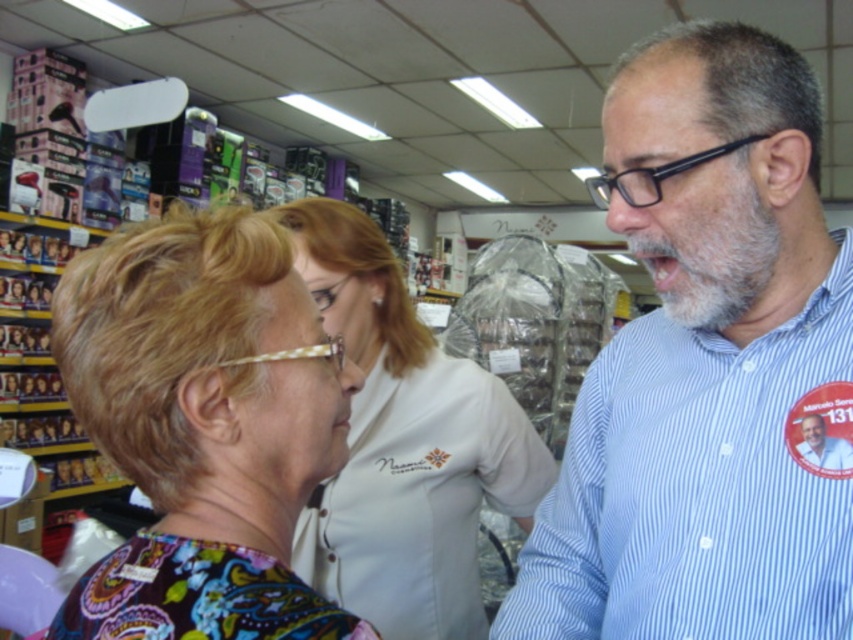
Can you confirm if multicolored fabric blouse at center is wider than white fabric shirt at center?

Incorrect, multicolored fabric blouse at center's width does not surpass white fabric shirt at center's.

Is multicolored fabric blouse at center positioned at the back of white fabric shirt at center?

No, it is in front of white fabric shirt at center.

The height and width of the screenshot is (640, 853). I want to click on multicolored fabric blouse at center, so click(202, 426).

Based on the photo, who is lower down, white fabric shirt at center or blue striped shirt at center?

Positioned lower is white fabric shirt at center.

Is white fabric shirt at center taller than blue striped shirt at center?

Correct, white fabric shirt at center is much taller as blue striped shirt at center.

Is point (329, 204) closer to camera compared to point (805, 451)?

No, it is behind (805, 451).

Find the location of a particular element. The height and width of the screenshot is (640, 853). white fabric shirt at center is located at coordinates (404, 445).

Is blue striped shirt at right above blue striped shirt at center?

Yes, blue striped shirt at right is above blue striped shirt at center.

Can you confirm if blue striped shirt at right is bigger than blue striped shirt at center?

Correct, blue striped shirt at right is larger in size than blue striped shirt at center.

This screenshot has width=853, height=640. I want to click on blue striped shirt at right, so click(x=706, y=368).

Where is `blue striped shirt at right`? The image size is (853, 640). blue striped shirt at right is located at coordinates (706, 368).